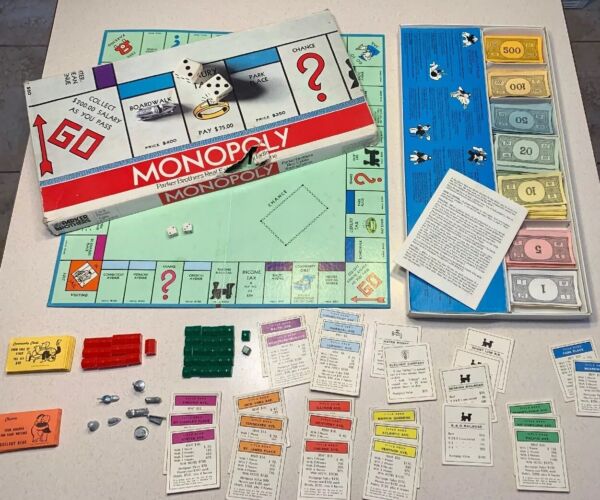
Identify the location of stacks of monopoly money. (527, 53), (527, 80), (524, 109), (524, 145), (533, 187), (561, 247), (558, 279).